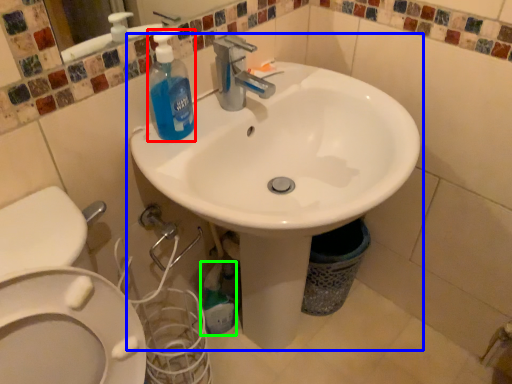
Question: Estimate the real-world distances between objects in this image. Which object is farther from cleaning product (highlighted by a red box), sink (highlighted by a blue box) or cleaning product (highlighted by a green box)?

Choices:
 (A) sink
 (B) cleaning product

Answer: (B)